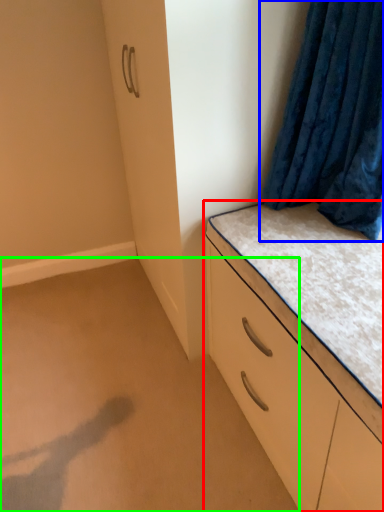
Question: Which object is the farthest from chest of drawers (highlighted by a red box)? Choose among these: curtain (highlighted by a blue box) or plain (highlighted by a green box).

Choices:
 (A) curtain
 (B) plain

Answer: (B)